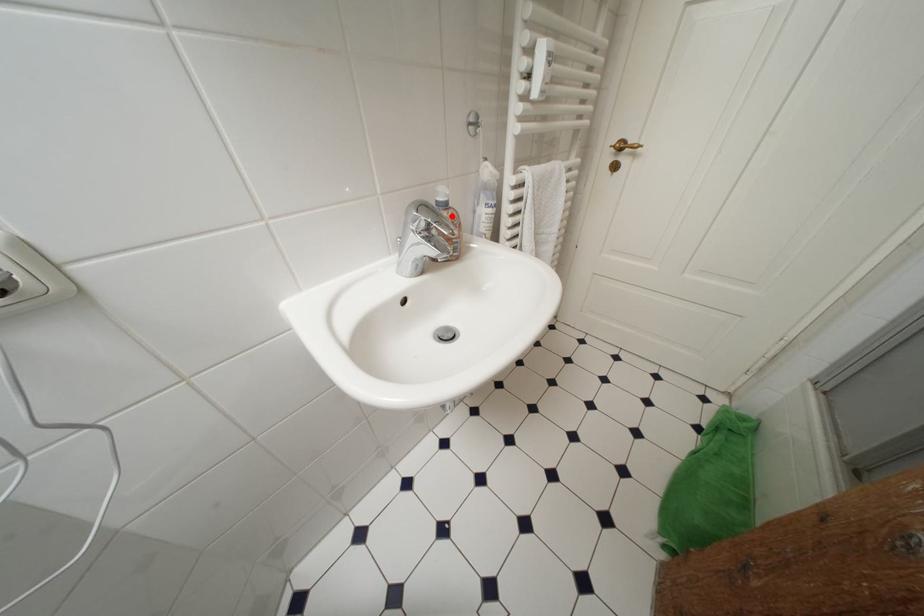
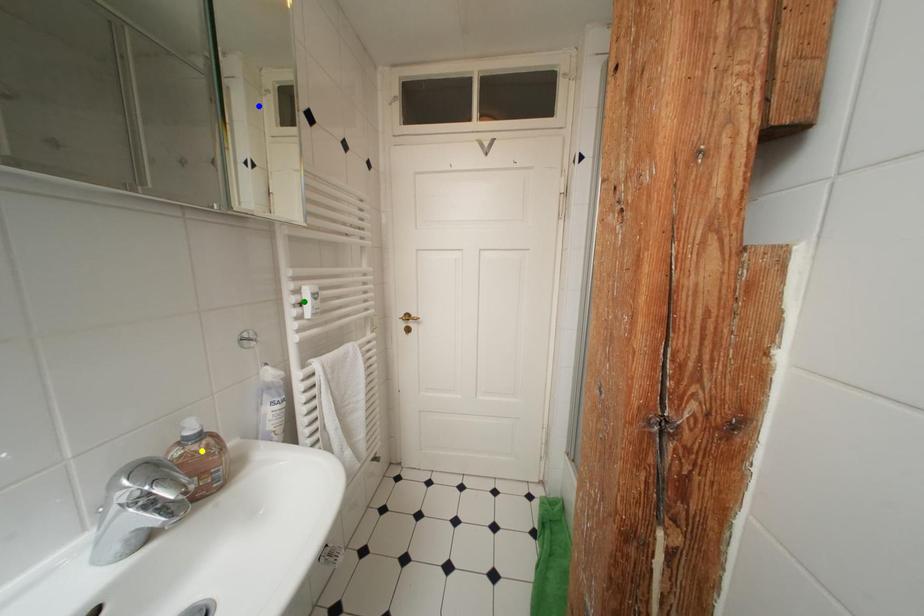
Question: I am providing you with two images of the same scene from different viewpoints. A red point is marked on the first image. You are given multiple points on the second image. In image 2, which mark is for the same physical point as the one in image 1?

Choices:
 (A) blue point
 (B) green point
 (C) yellow point

Answer: (C)